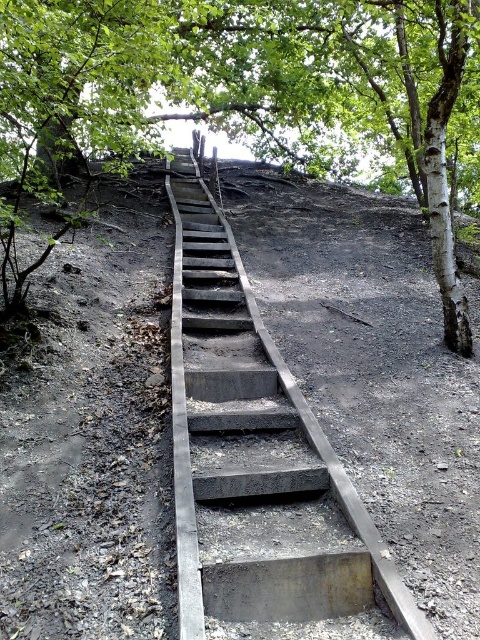
You are standing at the bottom of the stairs and want to reach the green leafy tree at upper center. Based on the coordinates provided, in which direction should you walk relative to the stairs?

The green leafy tree at upper center is located at coordinates point (236,97). Since the stairs lead upwards diagonally towards the top of the hill, you should walk up the stairs towards the top of the hill to reach the green leafy tree at upper center.

You are standing at the bottom of the wooden stairs and want to reach the point marked as point (299, 20). There is another point, point (261, 483), further away from you. Which point is closer to your current position?

Point (299, 20) is closer to your current position because it is further to the camera than point (261, 483), meaning it is physically nearer to you at the base of the stairs.